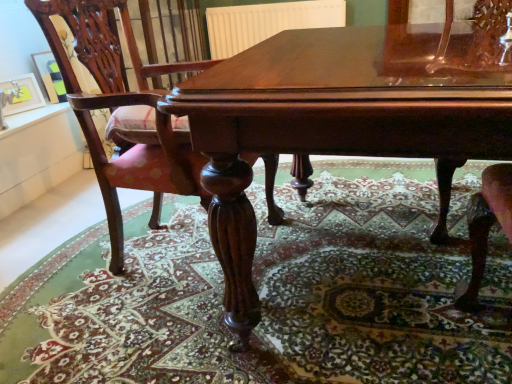
Locate an element on the screen. vacant region above carpeted floor at center (from a real-world perspective) is located at coordinates (206, 251).